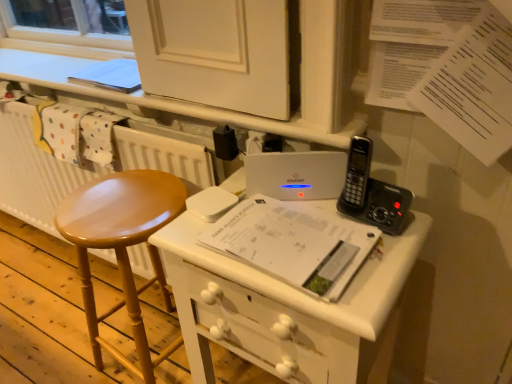
Question: Could you tell me if white paper at center is turned towards white matte radiator at left?

Choices:
 (A) yes
 (B) no

Answer: (B)

Question: Considering the relative sizes of white paper at center and white matte radiator at left in the image provided, is white paper at center wider than white matte radiator at left?

Choices:
 (A) yes
 (B) no

Answer: (A)

Question: Is white paper at center outside white matte radiator at left?

Choices:
 (A) no
 (B) yes

Answer: (B)

Question: Is there a large distance between white paper at center and white matte radiator at left?

Choices:
 (A) no
 (B) yes

Answer: (A)

Question: Is white matte radiator at left completely or partially inside white paper at center?

Choices:
 (A) no
 (B) yes

Answer: (A)

Question: Looking at the image, does white matte radiator at left seem bigger or smaller compared to white paper at center?

Choices:
 (A) big
 (B) small

Answer: (A)

Question: Considering the positions of white matte radiator at left and white paper at center in the image, is white matte radiator at left taller or shorter than white paper at center?

Choices:
 (A) short
 (B) tall

Answer: (B)

Question: Based on their positions, is white matte radiator at left located to the left or right of white paper at center?

Choices:
 (A) left
 (B) right

Answer: (A)

Question: Is white matte radiator at left inside or outside of white paper at center?

Choices:
 (A) outside
 (B) inside

Answer: (A)

Question: Is black plastic phone at upper right spatially inside white matte radiator at left, or outside of it?

Choices:
 (A) inside
 (B) outside

Answer: (B)

Question: Looking at the image, does black plastic phone at upper right seem bigger or smaller compared to white matte radiator at left?

Choices:
 (A) small
 (B) big

Answer: (A)

Question: Looking at their shapes, would you say black plastic phone at upper right is wider or thinner than white matte radiator at left?

Choices:
 (A) thin
 (B) wide

Answer: (A)

Question: Does point (357, 187) appear closer or farther from the camera than point (36, 200)?

Choices:
 (A) closer
 (B) farther

Answer: (A)

Question: From their relative heights in the image, would you say shiny wood stool at left is taller or shorter than black plastic phone at upper right?

Choices:
 (A) short
 (B) tall

Answer: (B)

Question: From the image's perspective, is shiny wood stool at left positioned above or below black plastic phone at upper right?

Choices:
 (A) above
 (B) below

Answer: (B)